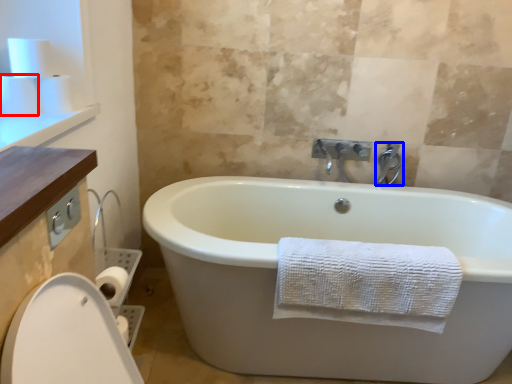
Question: Which object appears closest to the camera in this image, toilet paper (highlighted by a red box) or tap (highlighted by a blue box)?

Choices:
 (A) toilet paper
 (B) tap

Answer: (A)